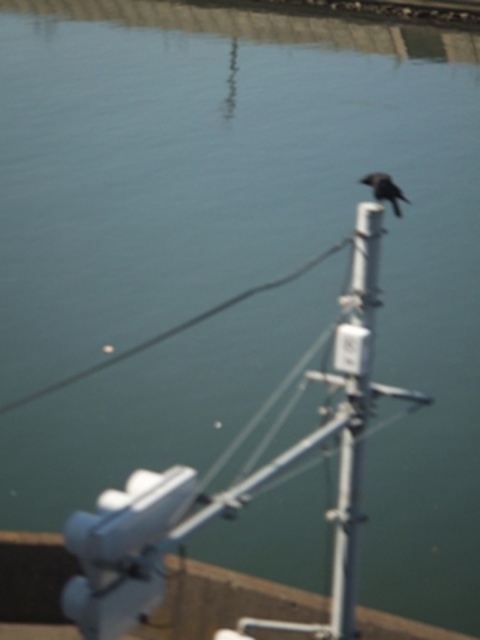
Is black wire at center above black matte bird at upper right?

No, black wire at center is not above black matte bird at upper right.

Is black wire at center thinner than black matte bird at upper right?

Yes.

The image size is (480, 640). I want to click on black wire at center, so click(x=173, y=330).

Is metallic gray telegraph pole at center wider than black wire at center?

In fact, metallic gray telegraph pole at center might be narrower than black wire at center.

At what (x,y) coordinates should I click in order to perform the action: click on metallic gray telegraph pole at center. Please return your answer as a coordinate pair (x, y). Looking at the image, I should click on (354, 413).

Which is in front, point (346, 490) or point (367, 176)?

Point (346, 490) is more forward.

Identify the location of metallic gray telegraph pole at center. (354, 413).

Which is behind, point (347, 564) or point (388, 195)?

Point (347, 564)

Where is `metallic gray telegraph pole at center`? This screenshot has height=640, width=480. metallic gray telegraph pole at center is located at coordinates (354, 413).